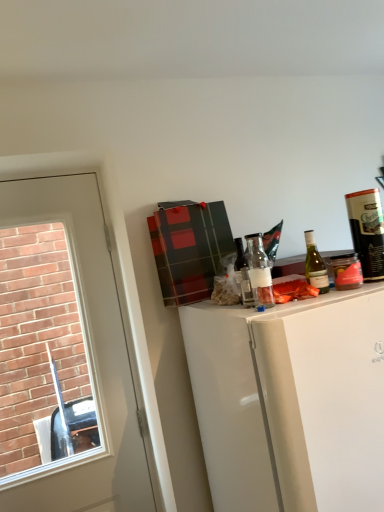
Question: Does translucent glass bottle at center, the 1th bottle in the left-to-right sequence, have a lesser width compared to matte black canister at upper right, the 3th bottle when ordered from left to right?

Choices:
 (A) yes
 (B) no

Answer: (A)

Question: Can you confirm if translucent glass bottle at center, the 1th bottle in the left-to-right sequence, is bigger than matte black canister at upper right, acting as the first bottle starting from the right?

Choices:
 (A) no
 (B) yes

Answer: (A)

Question: Can you confirm if translucent glass bottle at center, which appears as the third bottle when viewed from the right, is positioned to the left of matte black canister at upper right, the 3th bottle when ordered from left to right?

Choices:
 (A) yes
 (B) no

Answer: (A)

Question: Is translucent glass bottle at center, which appears as the third bottle when viewed from the right, oriented away from matte black canister at upper right, the 3th bottle when ordered from left to right?

Choices:
 (A) no
 (B) yes

Answer: (A)

Question: Is translucent glass bottle at center, the 1th bottle in the left-to-right sequence, not close to matte black canister at upper right, acting as the first bottle starting from the right?

Choices:
 (A) no
 (B) yes

Answer: (A)

Question: From a real-world perspective, is white glossy refrigerator at upper right physically located above or below green glass bottle at upper right?

Choices:
 (A) above
 (B) below

Answer: (B)

Question: In the image, is white glossy refrigerator at upper right on the left side or the right side of green glass bottle at upper right?

Choices:
 (A) right
 (B) left

Answer: (B)

Question: Is white glossy refrigerator at upper right wider or thinner than green glass bottle at upper right?

Choices:
 (A) thin
 (B) wide

Answer: (B)

Question: Is point (249, 382) positioned closer to the camera than point (342, 276)?

Choices:
 (A) closer
 (B) farther

Answer: (A)

Question: Based on their positions, is white glossy door at left located to the left or right of translucent glass bottle at center, the 1th bottle in the left-to-right sequence?

Choices:
 (A) right
 (B) left

Answer: (B)

Question: Looking at the image, does white glossy door at left seem bigger or smaller compared to translucent glass bottle at center, the 1th bottle in the left-to-right sequence?

Choices:
 (A) big
 (B) small

Answer: (A)

Question: Considering their positions, is white glossy door at left located in front of or behind translucent glass bottle at center, which appears as the third bottle when viewed from the right?

Choices:
 (A) behind
 (B) front

Answer: (A)

Question: Considering the positions of white glossy door at left and translucent glass bottle at center, which appears as the third bottle when viewed from the right, in the image, is white glossy door at left wider or thinner than translucent glass bottle at center, which appears as the third bottle when viewed from the right,?

Choices:
 (A) wide
 (B) thin

Answer: (A)

Question: From the image's perspective, relative to green glass bottle at upper right, placed as the 2th bottle when sorted from right to left, is translucent glass bottle at center, the 1th bottle in the left-to-right sequence, above or below?

Choices:
 (A) above
 (B) below

Answer: (B)

Question: Looking at the image, does translucent glass bottle at center, which appears as the third bottle when viewed from the right, seem bigger or smaller compared to green glass bottle at upper right, the second bottle when ordered from left to right?

Choices:
 (A) big
 (B) small

Answer: (B)